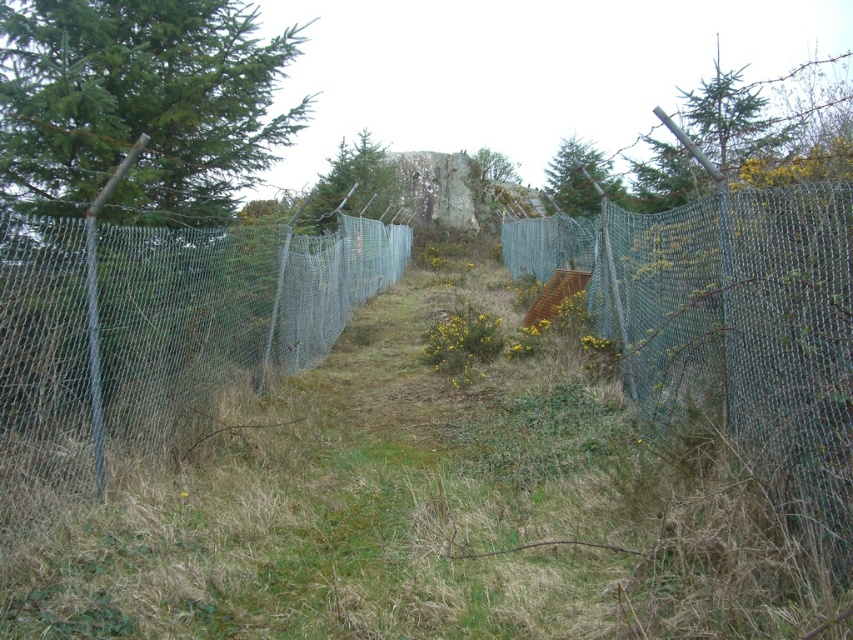
Identify the location of metal mesh fence at center. (154, 336).

Which is in front, point (9, 314) or point (512, 164)?

Point (9, 314)

This screenshot has width=853, height=640. I want to click on metal mesh fence at center, so tap(154, 336).

The width and height of the screenshot is (853, 640). What are the coordinates of `metal mesh fence at center` in the screenshot? It's located at (154, 336).

In the scene shown: Is metal mesh fence at center above green chain-link fence at right?

No, metal mesh fence at center is not above green chain-link fence at right.

The image size is (853, 640). Describe the element at coordinates (154, 336) in the screenshot. I see `metal mesh fence at center` at that location.

Where is `metal mesh fence at center`? The width and height of the screenshot is (853, 640). metal mesh fence at center is located at coordinates tap(154, 336).

Locate an element on the screen. green leafy tree at upper center is located at coordinates (352, 182).

Does green leafy tree at upper center have a greater height compared to green textured tree at upper center?

In fact, green leafy tree at upper center may be shorter than green textured tree at upper center.

Describe the element at coordinates (352, 182) in the screenshot. I see `green leafy tree at upper center` at that location.

Identify the location of green leafy tree at upper center. 352,182.